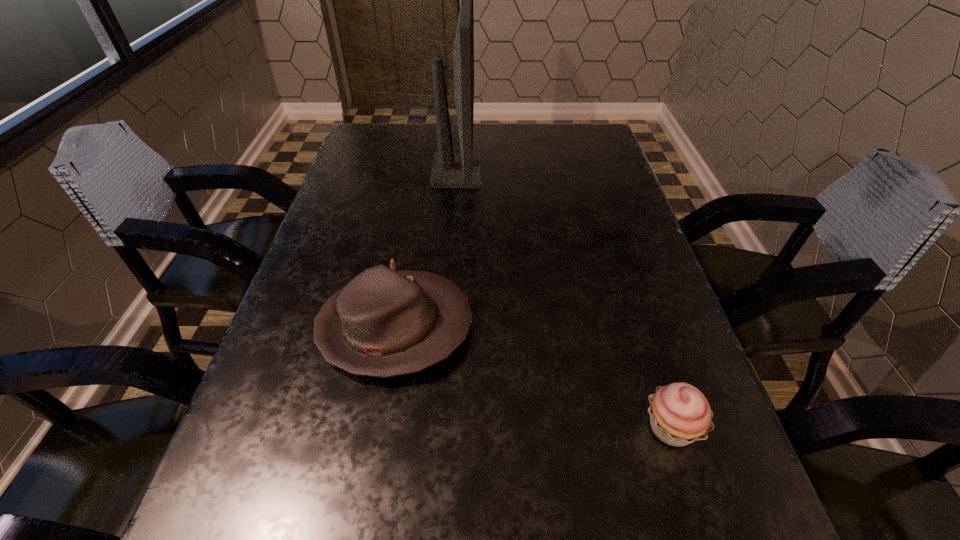
The image size is (960, 540). What are the coordinates of `free space that satisfies the following two spatial constraints: 1. on the back side of the cupcake; 2. on the front-facing side of the farthest object` in the screenshot? It's located at (588, 173).

The width and height of the screenshot is (960, 540). Identify the location of vacant point that satisfies the following two spatial constraints: 1. on the front-facing side of the cupcake; 2. on the right side of the farthest object. (439, 428).

You are a GUI agent. You are given a task and a screenshot of the screen. Output one action in this format:
    pyautogui.click(x=<x>, y=<y>)
    Task: Click on the vacant position in the image that satisfies the following two spatial constraints: 1. on the decorative side of the cupcake; 2. on the right side of the hat
    
    Given the screenshot: What is the action you would take?
    pyautogui.click(x=378, y=428)

In order to click on blank area in the image that satisfies the following two spatial constraints: 1. on the front-facing side of the nearest object; 2. on the right side of the computer monitor in this screenshot , I will do `click(439, 428)`.